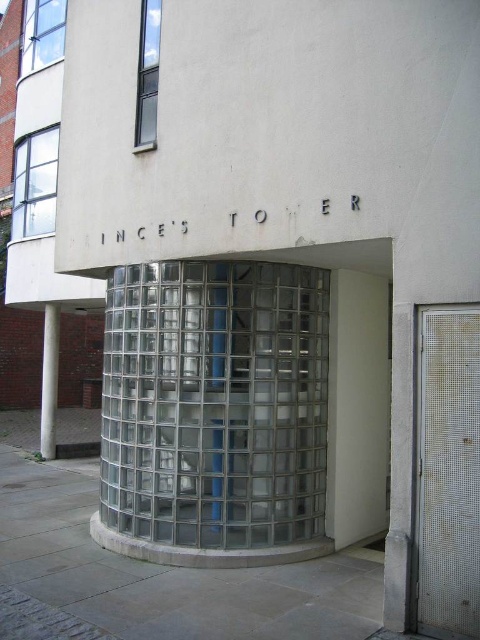
You are standing at a distance of 20 feet from the PRINCE S TOWER. You see a point at coordinates point (x=244, y=538). Is this point closer to you or farther than your current position?

The point at point (x=244, y=538) is 22.10 feet away from the camera, which is farther than your current position of 20 feet away from PRINCE S TOWER. Therefore, the point is farther away from you.

You are a delivery person trying to enter the Prince Tower. You see a clear glass door at center and a white marble column at left. Which object is narrower?

The clear glass door at center is thinner than the white marble column at left, so the clear glass door at center is narrower.

You are a visitor approaching the PRINCE S TOWER from the front entrance. You need to enter through the metal mesh door at lower right. Which direction should you move relative to the white marble column at left to reach the door?

The metal mesh door at lower right is located above the white marble column at left, so you should move upward from the white marble column at left to reach the door.